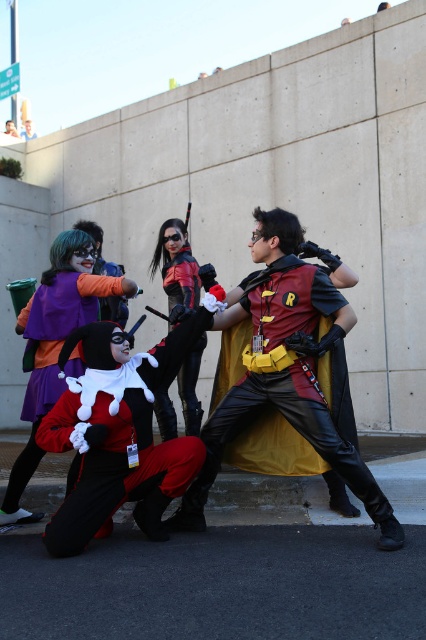
Can you confirm if matte red costume at center is positioned below white plush santa hat at lower left?

Yes, matte red costume at center is below white plush santa hat at lower left.

Between matte red costume at center and white plush santa hat at lower left, which one has less height?

matte red costume at center

Does point (71, 536) lie behind point (34, 417)?

No.

Find the location of a particular element. matte red costume at center is located at coordinates (118, 429).

Which of these two, shiny red vest at center or white plush santa hat at lower left, stands taller?

shiny red vest at center

Is shiny red vest at center behind white plush santa hat at lower left?

No.

The height and width of the screenshot is (640, 426). Describe the element at coordinates (284, 371) in the screenshot. I see `shiny red vest at center` at that location.

The width and height of the screenshot is (426, 640). I want to click on shiny red vest at center, so click(x=284, y=371).

Which is behind, point (37, 314) or point (198, 368)?

Positioned behind is point (198, 368).

In the scene shown: Which is more to the left, white plush santa hat at lower left or black leather gloves at center?

white plush santa hat at lower left is more to the left.

Is point (52, 307) less distant than point (193, 410)?

Yes, point (52, 307) is closer to viewer.

Find the location of `white plush santa hat at lower left`. white plush santa hat at lower left is located at coordinates (51, 356).